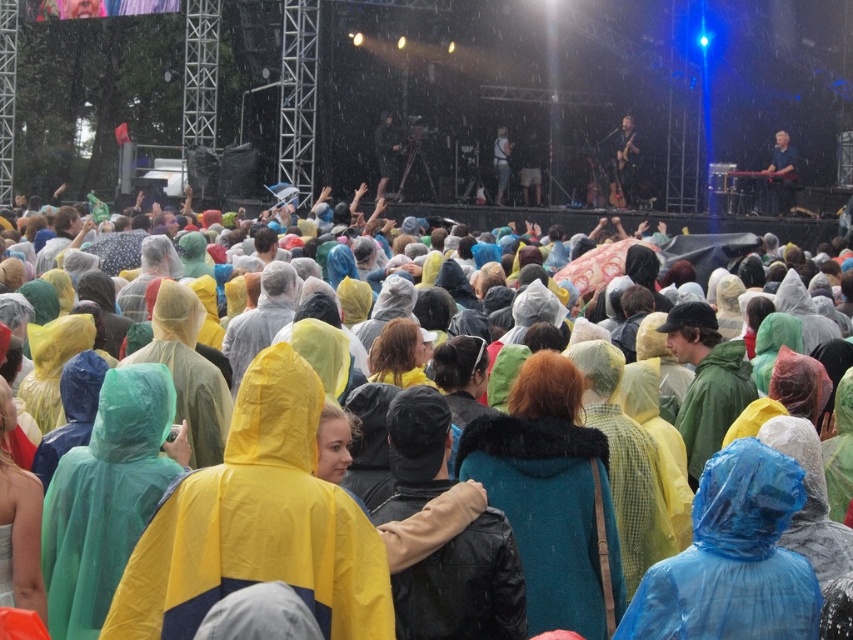
Does teal fur-trimmed coat at center have a larger size compared to shiny black guitar at upper right?

Indeed, teal fur-trimmed coat at center has a larger size compared to shiny black guitar at upper right.

Is teal fur-trimmed coat at center thinner than shiny black guitar at upper right?

In fact, teal fur-trimmed coat at center might be wider than shiny black guitar at upper right.

Where is `teal fur-trimmed coat at center`? The image size is (853, 640). teal fur-trimmed coat at center is located at coordinates (550, 497).

Which is below, shiny black guitar at upper right or smooth black guitar at upper right?

smooth black guitar at upper right

Does shiny black guitar at upper right have a lesser height compared to smooth black guitar at upper right?

In fact, shiny black guitar at upper right may be taller than smooth black guitar at upper right.

Where is `shiny black guitar at upper right`? The width and height of the screenshot is (853, 640). shiny black guitar at upper right is located at coordinates (624, 164).

Can you confirm if teal fur-trimmed coat at center is shorter than smooth black guitar at upper right?

No, teal fur-trimmed coat at center is not shorter than smooth black guitar at upper right.

Is teal fur-trimmed coat at center smaller than smooth black guitar at upper right?

No, teal fur-trimmed coat at center is not smaller than smooth black guitar at upper right.

I want to click on teal fur-trimmed coat at center, so click(x=550, y=497).